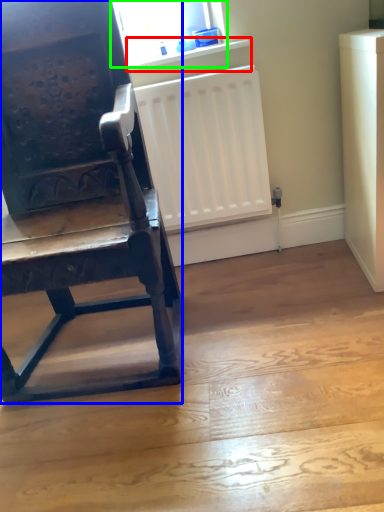
Question: Estimate the real-world distances between objects in this image. Which object is closer to window sill (highlighted by a red box), chair (highlighted by a blue box) or window screen (highlighted by a green box)?

Choices:
 (A) chair
 (B) window screen

Answer: (B)